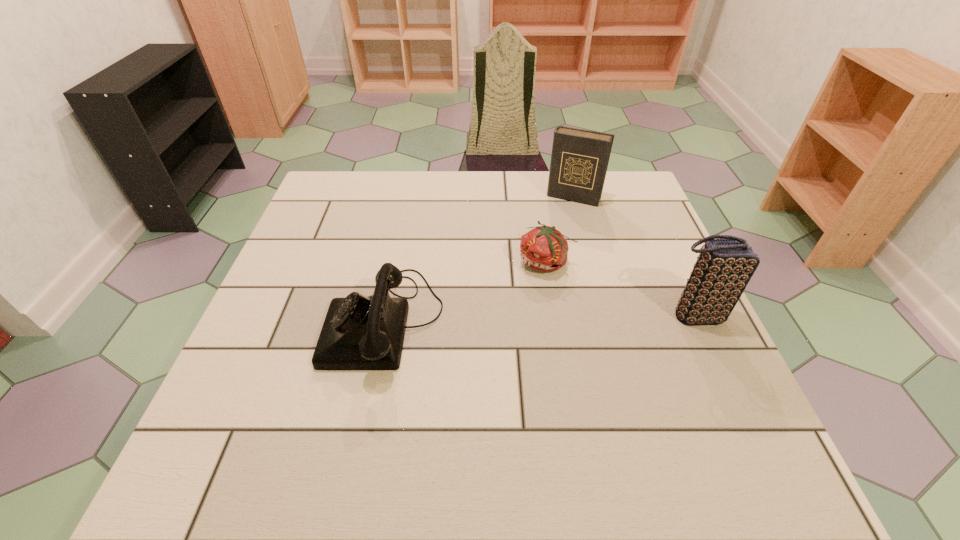
Locate an element on the screen. The image size is (960, 540). free space on the desktop that is between the telephone and the rightmost object and is positioned on the front cover of the diary is located at coordinates (522, 319).

Find the location of a particular element. Image resolution: width=960 pixels, height=540 pixels. vacant space on the desktop that is between the leftmost object and the rightmost object and is positioned on the front-facing side of the tomato is located at coordinates (515, 319).